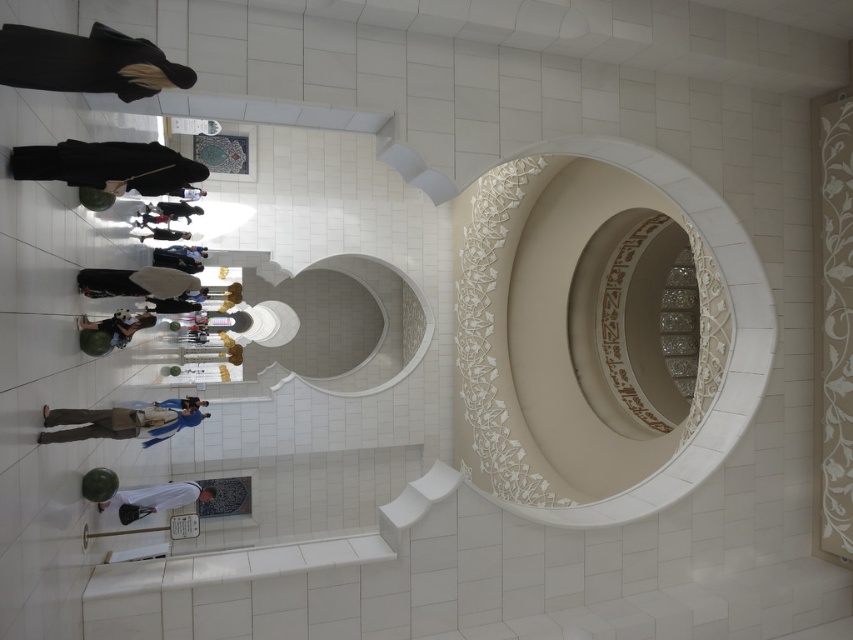
Is white carved stone at center further to camera compared to white glossy mirror at center?

That is False.

Identify the location of white carved stone at center. (566, 336).

Who is more forward, (544, 326) or (398, 353)?

Positioned in front is point (544, 326).

Image resolution: width=853 pixels, height=640 pixels. What are the coordinates of `white carved stone at center` in the screenshot? It's located at (566, 336).